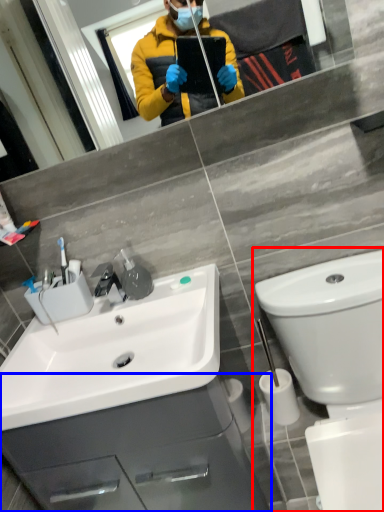
Question: Which of the following is the farthest to the observer, toilet (highlighted by a red box) or bathroom cabinet (highlighted by a blue box)?

Choices:
 (A) toilet
 (B) bathroom cabinet

Answer: (B)